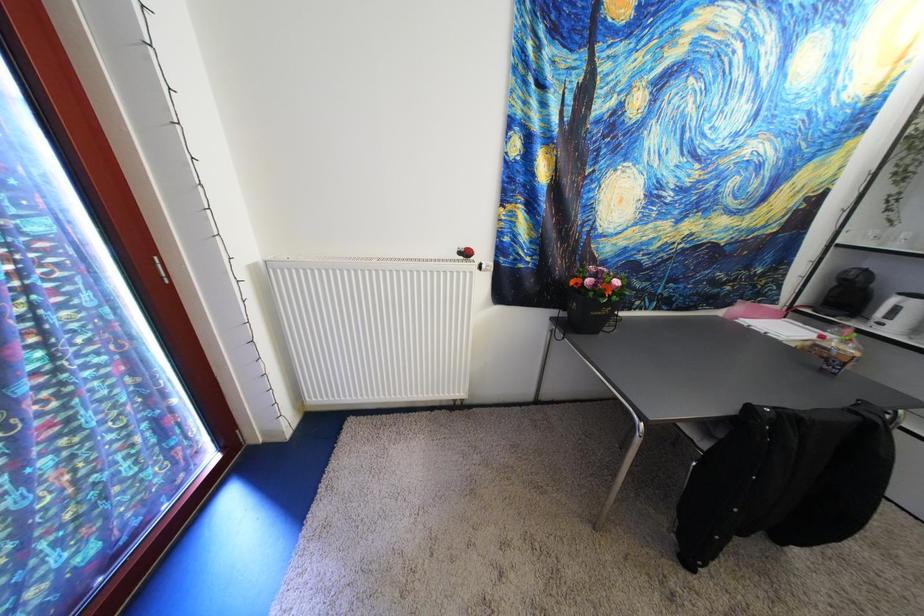
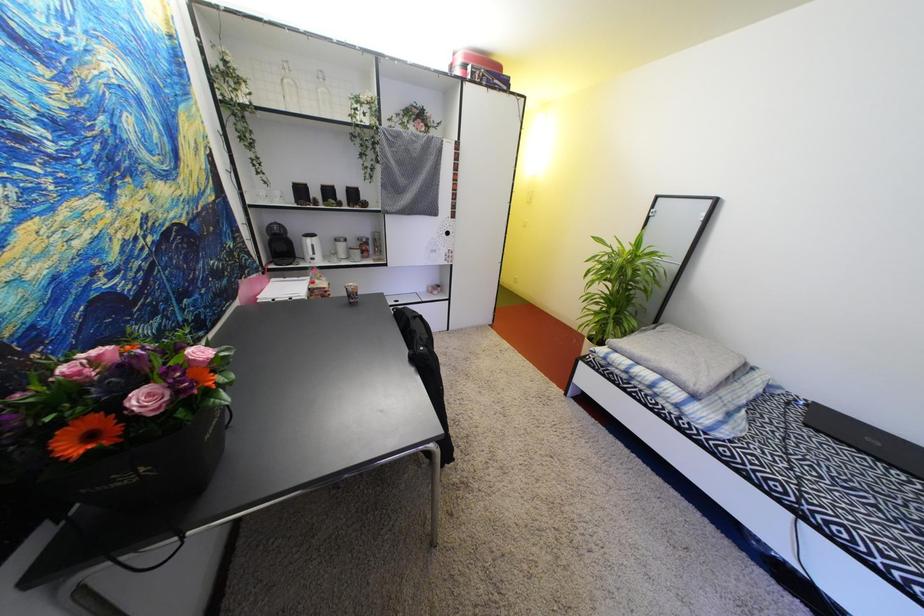
The first image is from the beginning of the video and the second image is from the end. How did the camera likely rotate when shooting the video?

The camera rotated toward right-down.